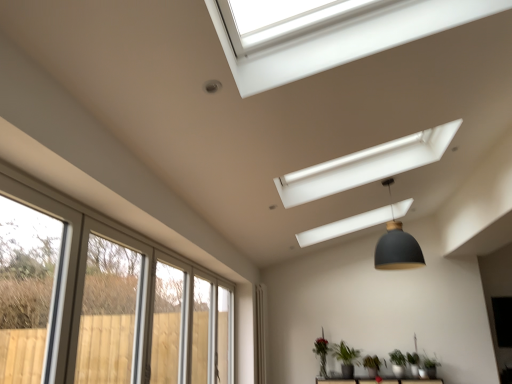
Question: Considering the positions of matte black pendant lamp at center and green matte plant at lower center, the 2th plant in the left-to-right sequence, in the image, is matte black pendant lamp at center wider or thinner than green matte plant at lower center, the 2th plant in the left-to-right sequence,?

Choices:
 (A) wide
 (B) thin

Answer: (A)

Question: Choose the correct answer: Is matte black pendant lamp at center inside green matte plant at lower center, the third plant from the right, or outside it?

Choices:
 (A) outside
 (B) inside

Answer: (A)

Question: Considering the real-world distances, which object is farthest from the white fabric curtain at lower center?

Choices:
 (A) matte black pendant lamp at center
 (B) green matte plant at lower center, the 1th plant viewed from the right
 (C) green matte plant at lower center, which is counted as the 1th plant, starting from the left
 (D) green matte plant at lower center, the 2th plant in the left-to-right sequence
 (E) green matte plant at lower center, arranged as the 3th plant when viewed from the left

Answer: (A)

Question: Which object is positioned farthest from the green matte plant at lower center, the 4th plant viewed from the left?

Choices:
 (A) green matte plant at lower center, the third plant from the right
 (B) green matte plant at lower center, the fourth plant from the right
 (C) clear glass screen door at lower left
 (D) matte black pendant lamp at center
 (E) green matte plant at lower center, arranged as the 3th plant when viewed from the left

Answer: (C)